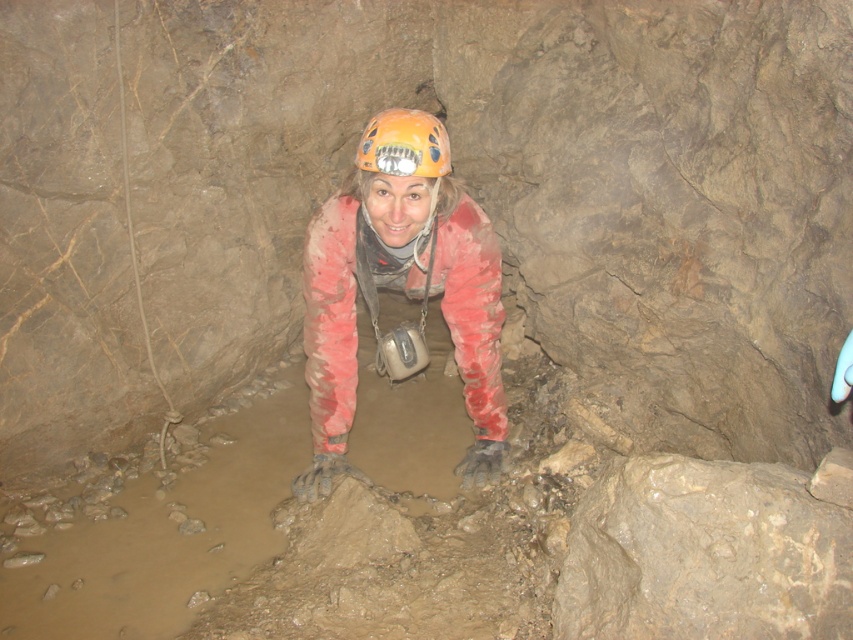
You are a caver who needs to decide which item to prioritize packing for your next trip based on their size. Given the muddy rubber boots at center and the orange matte helmet at center, which one requires more space in your backpack?

The muddy rubber boots at center requires more space in your backpack because it is larger in size than the orange matte helmet at center.

You are a caver who has just entered the cave and sees the orange matte helmet at center and muddy rubber boots at center. Which object is closer to the ground?

The muddy rubber boots at center is located below orange matte helmet at center, so the muddy rubber boots at center is closer to the ground.

You are a caver who just entered the cave and see the image. You need to place your muddy rubber boots somewhere safe and dry. Is the location at point (399, 288) suitable for storing your muddy rubber boots?

The location at point (399, 288) has muddy rubber boots at center, so it is not suitable for storing your muddy rubber boots as they are already present there.